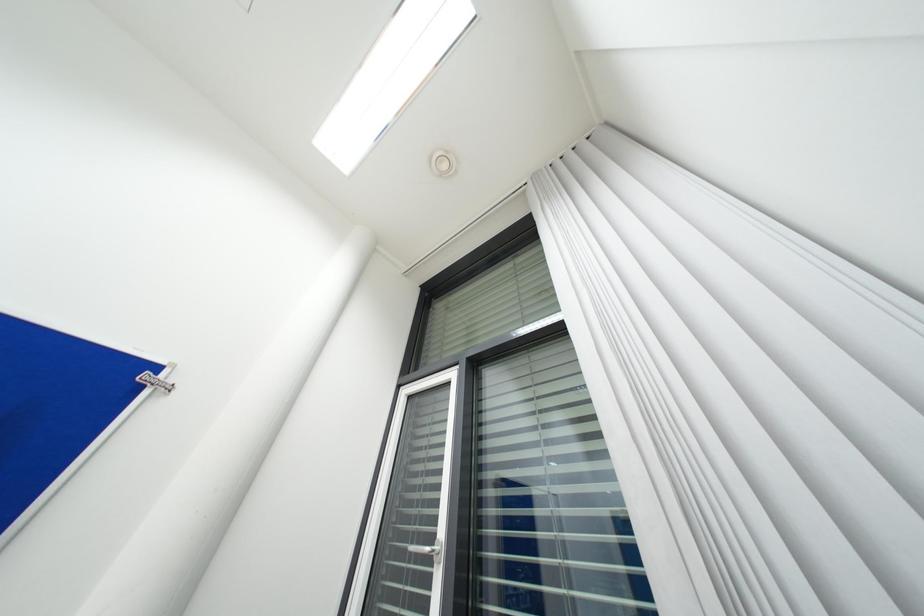
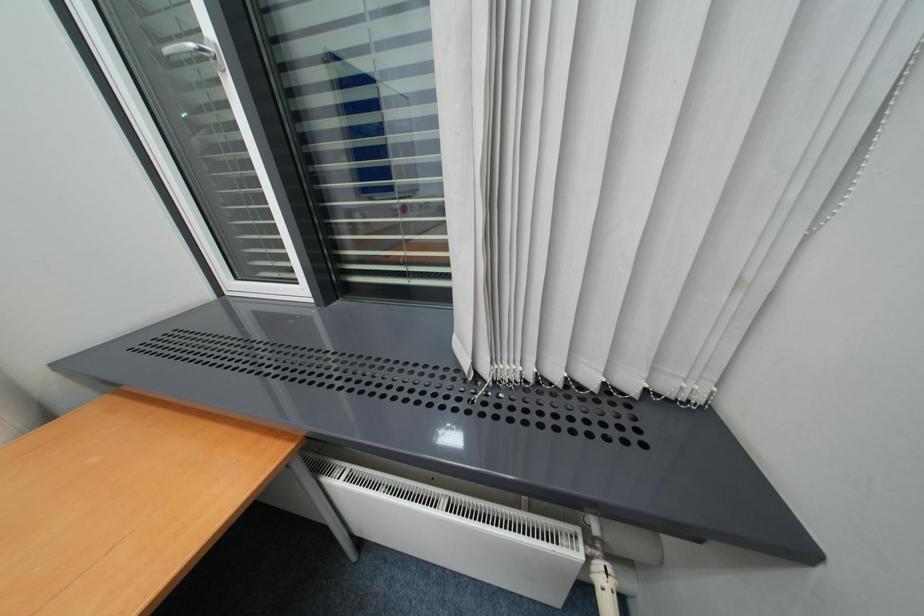
The images are taken continuously from a first-person perspective. In which direction is your viewpoint rotating?

The camera's rotation is toward right-down.